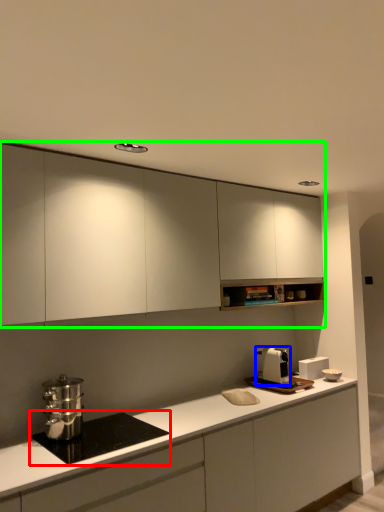
Question: Considering the real-world distances, which object is farthest from home appliance (highlighted by a red box)? kitchen appliance (highlighted by a blue box) or cabinetry (highlighted by a green box)?

Choices:
 (A) kitchen appliance
 (B) cabinetry

Answer: (A)